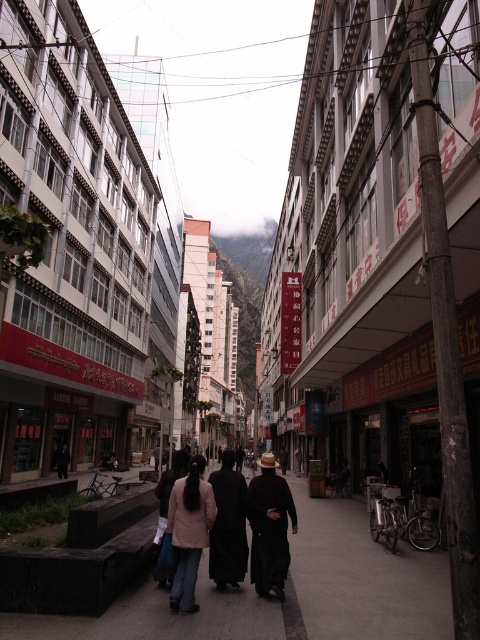
Does dark gray concrete pavement at center appear on the left side of light pink fabric jacket at center?

Incorrect, dark gray concrete pavement at center is not on the left side of light pink fabric jacket at center.

From the picture: Is dark gray concrete pavement at center wider than light pink fabric jacket at center?

Indeed, dark gray concrete pavement at center has a greater width compared to light pink fabric jacket at center.

Who is more distant from viewer, (x=336, y=513) or (x=183, y=612)?

The point (x=336, y=513) is more distant.

Locate an element on the screen. Image resolution: width=480 pixels, height=640 pixels. dark gray concrete pavement at center is located at coordinates (288, 593).

Does dark brown leather hat at center have a lesser width compared to black matte coat at center?

Incorrect, dark brown leather hat at center's width is not less than black matte coat at center's.

Who is lower down, dark brown leather hat at center or black matte coat at center?

dark brown leather hat at center is lower down.

Is point (232, 492) farther from camera compared to point (254, 538)?

Yes.

The height and width of the screenshot is (640, 480). What are the coordinates of `dark brown leather hat at center` in the screenshot? It's located at (203, 529).

The image size is (480, 640). Describe the element at coordinates (288, 593) in the screenshot. I see `dark gray concrete pavement at center` at that location.

Between dark gray concrete pavement at center and black matte coat at center, which one has more height?

With more height is dark gray concrete pavement at center.

The height and width of the screenshot is (640, 480). Identify the location of dark gray concrete pavement at center. (288, 593).